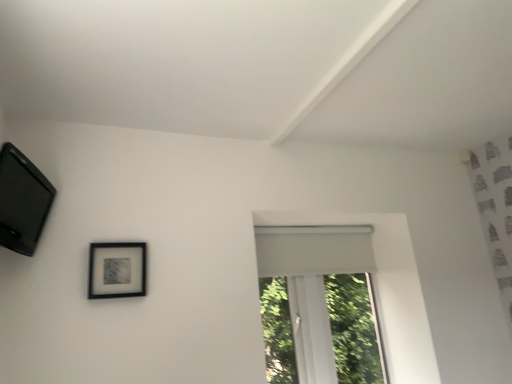
This screenshot has height=384, width=512. Identify the location of matte black picture frame at upper left, the 1th picture frame ordered from the bottom. (117, 270).

Image resolution: width=512 pixels, height=384 pixels. Find the location of `white matte window at center`. white matte window at center is located at coordinates (319, 305).

Identify the location of matte black picture frame at upper left, placed as the second picture frame when sorted from front to back. (117, 270).

Which object is further away from the camera, black matte picture frame at upper left, positioned as the second picture frame in bottom-to-top order, or matte black picture frame at upper left, the second picture frame viewed from the left?

matte black picture frame at upper left, the second picture frame viewed from the left, is further from the camera.

Is black matte picture frame at upper left, the 1th picture frame positioned from the left, located outside matte black picture frame at upper left, the first picture frame from the right?

Yes, black matte picture frame at upper left, the 1th picture frame positioned from the left, is outside of matte black picture frame at upper left, the first picture frame from the right.

Can you confirm if black matte picture frame at upper left, the second picture frame in the back-to-front sequence, is thinner than matte black picture frame at upper left, the first picture frame from the right?

No.

Which of these two, black matte picture frame at upper left, the 1th picture frame positioned from the left, or matte black picture frame at upper left, the second picture frame viewed from the left, stands taller?

Standing taller between the two is black matte picture frame at upper left, the 1th picture frame positioned from the left.

Who is smaller, white matte window at center or matte black picture frame at upper left, the first picture frame from the back?

matte black picture frame at upper left, the first picture frame from the back.

Do you think white matte window at center is within matte black picture frame at upper left, the second picture frame viewed from the left, or outside of it?

white matte window at center exists outside the volume of matte black picture frame at upper left, the second picture frame viewed from the left.

Is white matte window at center to the left or to the right of matte black picture frame at upper left, placed as the second picture frame when sorted from front to back, in the image?

Based on their positions, white matte window at center is located to the right of matte black picture frame at upper left, placed as the second picture frame when sorted from front to back.

From the image's perspective, would you say white matte window at center is positioned over matte black picture frame at upper left, the first picture frame from the back?

Incorrect, from the image's perspective, white matte window at center is lower than matte black picture frame at upper left, the first picture frame from the back.

Considering the sizes of matte black picture frame at upper left, the 1th picture frame ordered from the bottom, and white matte window at center in the image, is matte black picture frame at upper left, the 1th picture frame ordered from the bottom, taller or shorter than white matte window at center?

Clearly, matte black picture frame at upper left, the 1th picture frame ordered from the bottom, is shorter compared to white matte window at center.

Between matte black picture frame at upper left, the 1th picture frame ordered from the bottom, and white matte window at center, which one appears on the left side from the viewer's perspective?

matte black picture frame at upper left, the 1th picture frame ordered from the bottom.

From a real-world perspective, does matte black picture frame at upper left, positioned as the second picture frame in top-to-bottom order, stand above white matte window at center?

Yes.

From a real-world perspective, which is physically below, white matte window at center or black matte picture frame at upper left, the second picture frame in the back-to-front sequence?

white matte window at center, from a real-world perspective.

Is black matte picture frame at upper left, positioned as the 2th picture frame in right-to-left order, located within white matte window at center?

No, black matte picture frame at upper left, positioned as the 2th picture frame in right-to-left order, is located outside of white matte window at center.

Would you say white matte window at center is a long distance from black matte picture frame at upper left, positioned as the second picture frame in bottom-to-top order?

Yes, white matte window at center and black matte picture frame at upper left, positioned as the second picture frame in bottom-to-top order, are located far from each other.

Is white matte window at center oriented towards black matte picture frame at upper left, arranged as the 1th picture frame when viewed from the top?

No, white matte window at center is not facing towards black matte picture frame at upper left, arranged as the 1th picture frame when viewed from the top.

From a real-world perspective, is black matte picture frame at upper left, arranged as the 1th picture frame when viewed from the top, on white matte window at center?

Yes, from a real-world perspective, black matte picture frame at upper left, arranged as the 1th picture frame when viewed from the top, is above white matte window at center.

Does black matte picture frame at upper left, the 1th picture frame viewed from the front, appear on the left side of white matte window at center?

Yes, black matte picture frame at upper left, the 1th picture frame viewed from the front, is to the left of white matte window at center.

Starting from the white matte window at center, which picture frame is the 2nd one to the left? Please provide its 2D coordinates.

[(22, 201)]

Between black matte picture frame at upper left, arranged as the 1th picture frame when viewed from the top, and white matte window at center, which one has more height?

With more height is white matte window at center.

How different are the orientations of matte black picture frame at upper left, positioned as the second picture frame in top-to-bottom order, and black matte picture frame at upper left, the 1th picture frame viewed from the front, in degrees?

74.4 degrees separate the facing orientations of matte black picture frame at upper left, positioned as the second picture frame in top-to-bottom order, and black matte picture frame at upper left, the 1th picture frame viewed from the front.

Looking at this image, is matte black picture frame at upper left, the first picture frame from the back, inside the boundaries of black matte picture frame at upper left, arranged as the 1th picture frame when viewed from the top, or outside?

matte black picture frame at upper left, the first picture frame from the back, lies outside black matte picture frame at upper left, arranged as the 1th picture frame when viewed from the top.

Considering the sizes of matte black picture frame at upper left, the 1th picture frame ordered from the bottom, and black matte picture frame at upper left, positioned as the 2th picture frame in right-to-left order, in the image, is matte black picture frame at upper left, the 1th picture frame ordered from the bottom, taller or shorter than black matte picture frame at upper left, positioned as the 2th picture frame in right-to-left order,?

Clearly, matte black picture frame at upper left, the 1th picture frame ordered from the bottom, is shorter compared to black matte picture frame at upper left, positioned as the 2th picture frame in right-to-left order.

From the image's perspective, which is above, matte black picture frame at upper left, positioned as the second picture frame in top-to-bottom order, or black matte picture frame at upper left, the second picture frame in the back-to-front sequence?

black matte picture frame at upper left, the second picture frame in the back-to-front sequence.

You are a GUI agent. You are given a task and a screenshot of the screen. Output one action in this format:
    pyautogui.click(x=<x>, y=<y>)
    Task: Click on the picture frame located above the matte black picture frame at upper left, the second picture frame viewed from the left (from the image's perspective)
    
    Given the screenshot: What is the action you would take?
    pyautogui.click(x=22, y=201)

Starting from the white matte window at center, which picture frame is the 1st one to the left? Please provide its 2D coordinates.

[(117, 270)]

From the image, which object appears to be nearer to white matte window at center, black matte picture frame at upper left, the 1th picture frame positioned from the left, or matte black picture frame at upper left, the first picture frame from the back?

matte black picture frame at upper left, the first picture frame from the back, lies closer to white matte window at center than the other object.

Estimate the real-world distances between objects in this image. Which object is further from black matte picture frame at upper left, positioned as the 2th picture frame in right-to-left order, white matte window at center or matte black picture frame at upper left, placed as the second picture frame when sorted from front to back?

Among the two, white matte window at center is located further to black matte picture frame at upper left, positioned as the 2th picture frame in right-to-left order.

When comparing their distances from black matte picture frame at upper left, positioned as the 2th picture frame in right-to-left order, does matte black picture frame at upper left, the 1th picture frame ordered from the bottom, or white matte window at center seem further?

Based on the image, white matte window at center appears to be further to black matte picture frame at upper left, positioned as the 2th picture frame in right-to-left order.

Considering their positions, is black matte picture frame at upper left, the second picture frame in the back-to-front sequence, positioned further to matte black picture frame at upper left, the first picture frame from the right, than white matte window at center?

white matte window at center is positioned further to the anchor matte black picture frame at upper left, the first picture frame from the right.

Consider the image. Looking at the image, which one is located further to matte black picture frame at upper left, placed as the second picture frame when sorted from front to back, white matte window at center or black matte picture frame at upper left, positioned as the second picture frame in bottom-to-top order?

white matte window at center is positioned further to the anchor matte black picture frame at upper left, placed as the second picture frame when sorted from front to back.

Estimate the real-world distances between objects in this image. Which object is further from white matte window at center, matte black picture frame at upper left, the first picture frame from the back, or black matte picture frame at upper left, the 1th picture frame viewed from the front?

black matte picture frame at upper left, the 1th picture frame viewed from the front, is further to white matte window at center.

Find the location of `picture frame between black matte picture frame at upper left, the 1th picture frame positioned from the left, and white matte window at center`. picture frame between black matte picture frame at upper left, the 1th picture frame positioned from the left, and white matte window at center is located at coordinates (117, 270).